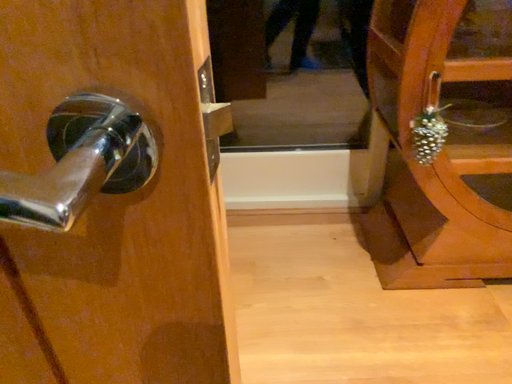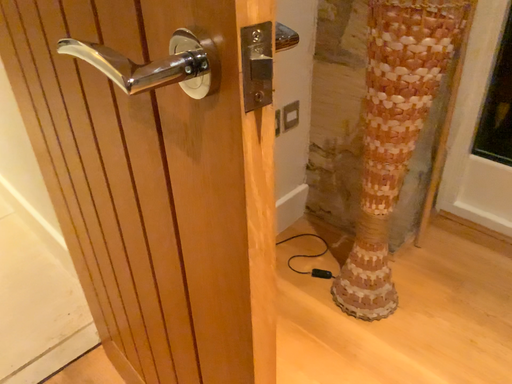
Question: Which way did the camera rotate in the video?

Choices:
 (A) rotated right
 (B) rotated left

Answer: (B)